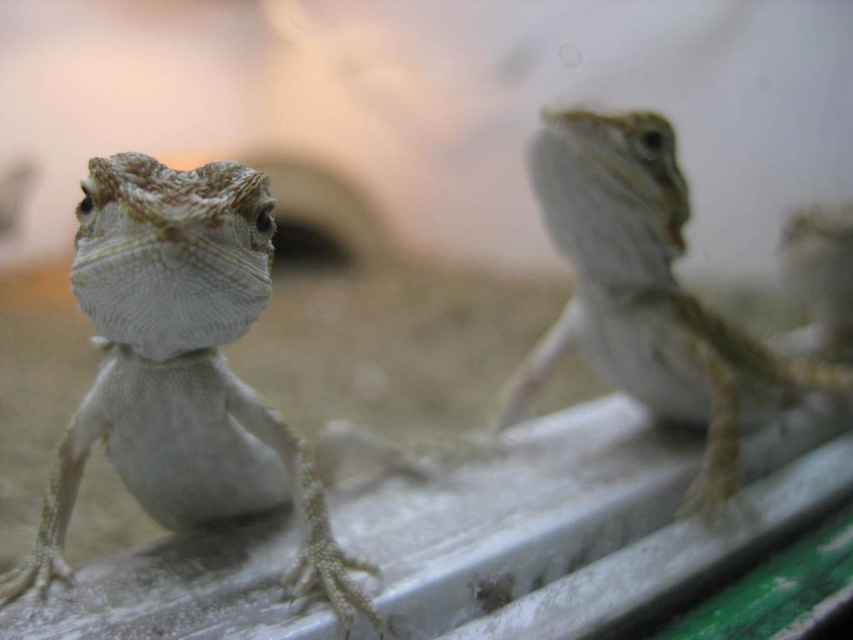
Between point (120, 262) and point (671, 257), which one is positioned in front?

Point (120, 262) is in front.

Which is behind, point (231, 230) or point (572, 202)?

The point (572, 202) is behind.

Describe the element at coordinates (183, 369) in the screenshot. The image size is (853, 640). I see `smooth beige lizard at center` at that location.

What are the coordinates of `smooth beige lizard at center` in the screenshot? It's located at (183, 369).